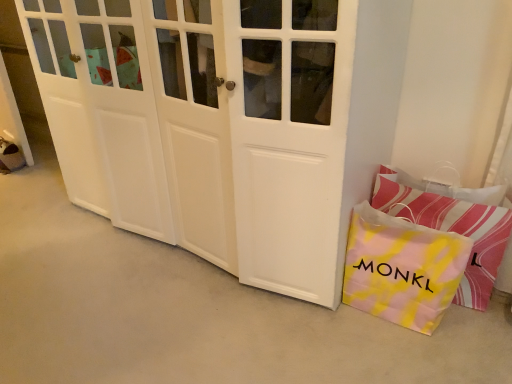
Find the location of a particular element. This screenshot has height=384, width=512. vacant area that is situated to the right of yellow tie-dye paper bag at lower right is located at coordinates (478, 337).